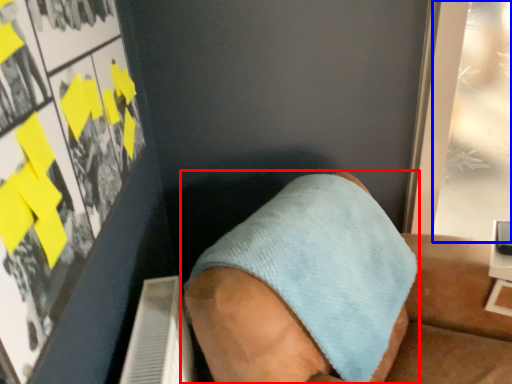
Question: Which object is closer to the camera taking this photo, footwear (highlighted by a red box) or poster page (highlighted by a blue box)?

Choices:
 (A) footwear
 (B) poster page

Answer: (A)